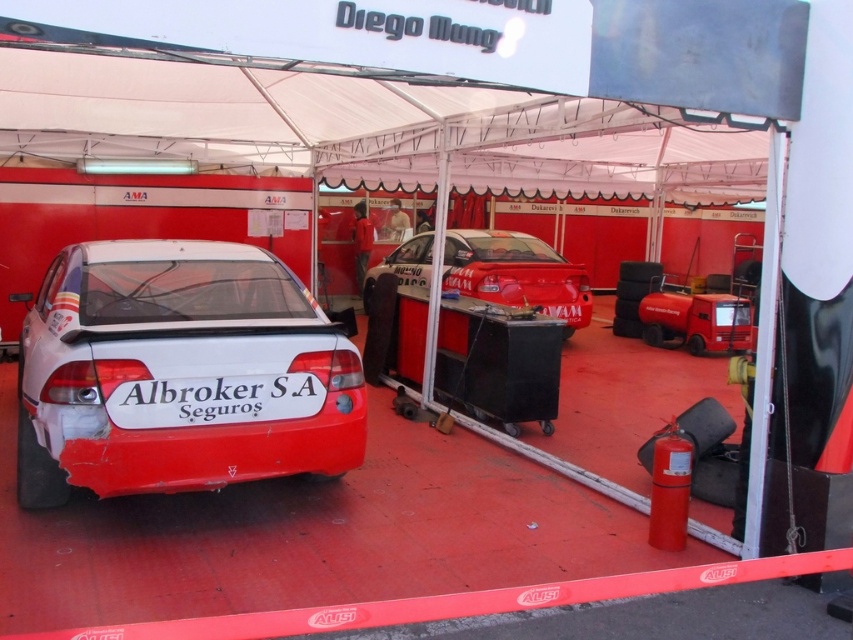
You are standing at the entrance of the tent and want to take a photo of the two points marked in the scene. Which point, point [167,268] or point [570,269], will appear larger in your photo?

Point [167,268] will appear larger in the photo because it is closer to the camera than point [570,269].

You are at a car exhibition and want to take a photo of the white glossy car at center and the glossy white car at center. Since both cars are under the canopy, which one is positioned lower from the ground?

The white glossy car at center is positioned lower from the ground than the glossy white car at center.